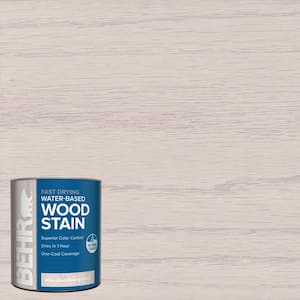
This screenshot has height=300, width=300. I want to click on wood stain, so click(x=55, y=211), click(x=56, y=219).